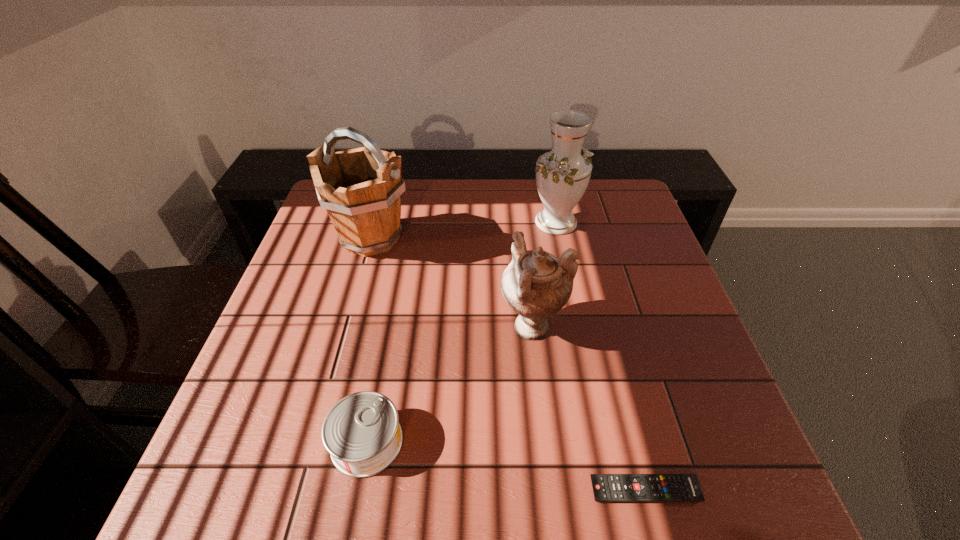
Find the location of a particular element. bucket is located at coordinates (361, 188).

I want to click on vase, so click(562, 175).

Locate an element on the screen. This screenshot has height=540, width=960. the third shortest object is located at coordinates (536, 285).

You are a GUI agent. You are given a task and a screenshot of the screen. Output one action in this format:
    pyautogui.click(x=<x>, y=<y>)
    Task: Click on the third farthest object
    This screenshot has height=540, width=960.
    Given the screenshot: What is the action you would take?
    pyautogui.click(x=536, y=285)

Find the location of a particular element. This screenshot has width=960, height=540. can is located at coordinates (362, 433).

Find the location of `the shortest object`. the shortest object is located at coordinates (606, 487).

At what (x,y) coordinates should I click in order to perform the action: click on free spot located 0.200m on the back of the bucket. Please return your answer as a coordinate pair (x, y). This screenshot has height=540, width=960. Looking at the image, I should click on (388, 179).

Find the location of a particular element. vacant point located on the front of the vase is located at coordinates (563, 251).

This screenshot has width=960, height=540. In order to click on vacant region located 0.150m on the left of the urn in this screenshot , I will do `click(435, 326)`.

The width and height of the screenshot is (960, 540). Identify the location of free region located 0.280m on the back of the second shortest object. (393, 305).